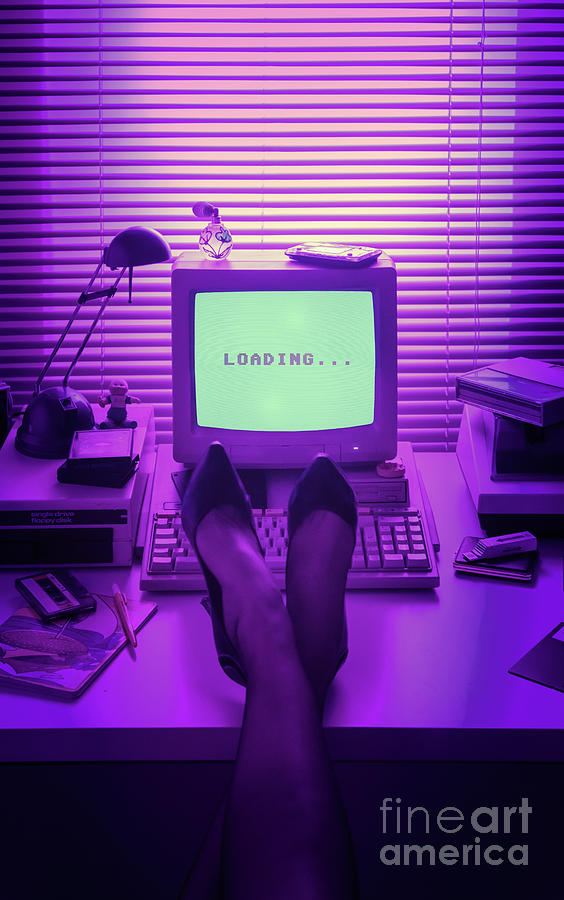
Locate an element on the screen. table top is located at coordinates (191, 668), (376, 678), (470, 618).